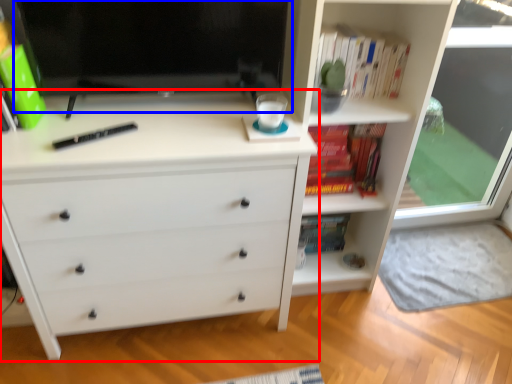
Question: Among these objects, which one is nearest to the camera, chest of drawers (highlighted by a red box) or computer monitor (highlighted by a blue box)?

Choices:
 (A) chest of drawers
 (B) computer monitor

Answer: (A)